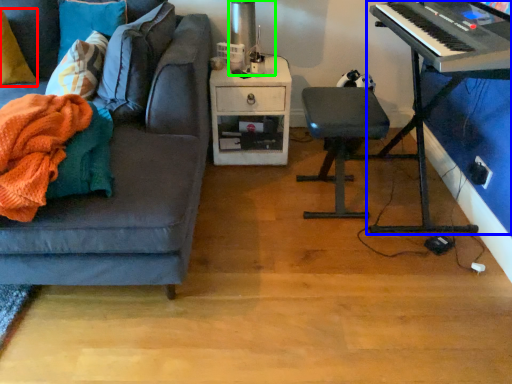
Question: Which is nearer to the pillow (highlighted by a red box)? piano (highlighted by a blue box) or table lamp (highlighted by a green box).

Choices:
 (A) piano
 (B) table lamp

Answer: (B)